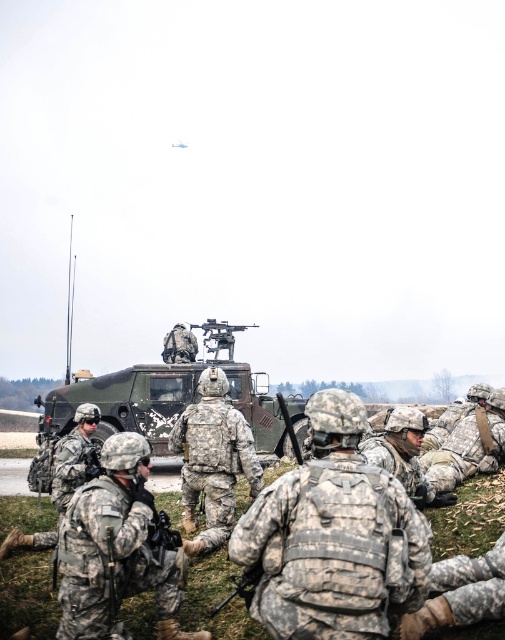
Question: Is camouflage fabric backpack at center wider than camouflage fabric tank at center?

Choices:
 (A) yes
 (B) no

Answer: (B)

Question: Estimate the real-world distances between objects in this image. Which object is closer to the camouflage fabric tank at center?

Choices:
 (A) camouflage fabric backpack at center
 (B) camouflage fabric uniform at lower right
 (C) camouflage uniform at center
 (D) camouflage fabric uniform at center

Answer: (C)

Question: Which of the following is the farthest from the observer?

Choices:
 (A) camouflage fabric uniform at center
 (B) camouflage fabric backpack at center

Answer: (A)

Question: Estimate the real-world distances between objects in this image. Which object is closer to the camouflage fabric uniform at center?

Choices:
 (A) camouflage fabric backpack at center
 (B) camouflage uniform at center

Answer: (A)

Question: Does camouflage fabric tank at center have a smaller size compared to camouflage uniform at center?

Choices:
 (A) yes
 (B) no

Answer: (B)

Question: Is camouflage fabric backpack at center to the right of camouflage fabric uniform at lower right from the viewer's perspective?

Choices:
 (A) no
 (B) yes

Answer: (A)